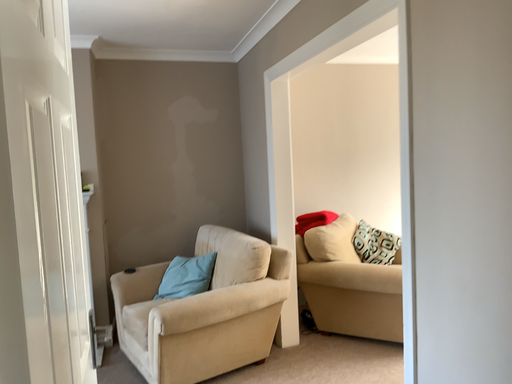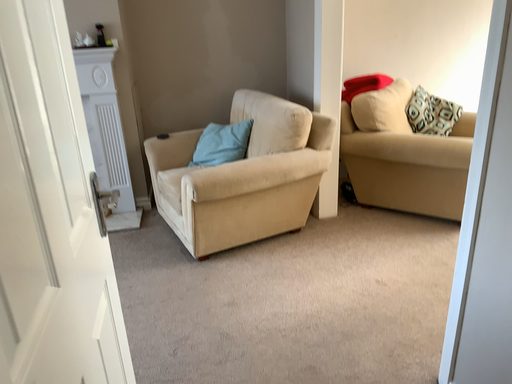
Question: How did the camera likely rotate when shooting the video?

Choices:
 (A) rotated upward
 (B) rotated downward

Answer: (B)